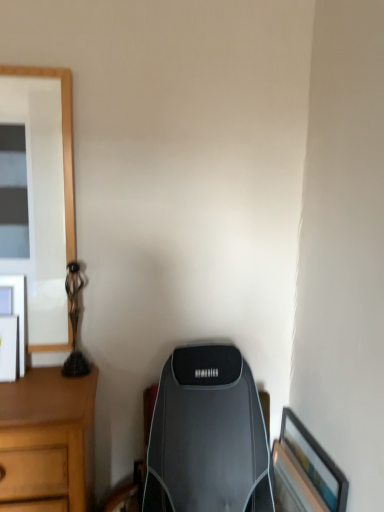
Question: Choose the correct answer: Is wooden framed picture at lower right, which is the 2th picture frame in left-to-right order, inside matte black picture frame at left, the 1th picture frame viewed from the left, or outside it?

Choices:
 (A) inside
 (B) outside

Answer: (B)

Question: From a real-world perspective, is wooden framed picture at lower right, the 1th picture frame in the bottom-to-top sequence, positioned above or below matte black picture frame at left, the 1th picture frame viewed from the left?

Choices:
 (A) below
 (B) above

Answer: (A)

Question: Which is farther from the matte black picture frame at left, the 1th picture frame viewed from the top?

Choices:
 (A) bronze/statue at left
 (B) wooden framed picture at lower right, which is counted as the 1th picture frame, starting from the right

Answer: (B)

Question: Which is farther from the wooden framed picture at lower right, marked as the second picture frame in a top-to-bottom arrangement?

Choices:
 (A) matte black picture frame at left, the 1th picture frame viewed from the top
 (B) bronze/statue at left

Answer: (A)